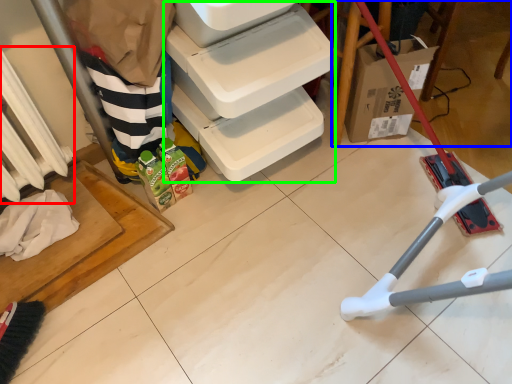
Question: Which object is the closest to the radiator (highlighted by a red box)? Choose among these: furniture (highlighted by a blue box) or shelf (highlighted by a green box).

Choices:
 (A) furniture
 (B) shelf

Answer: (B)